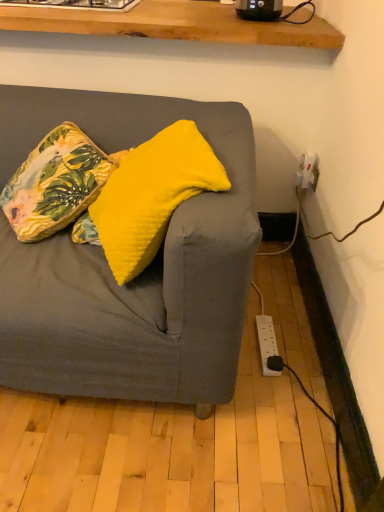
Question: From the image's perspective, is yellow soft cushion at center, arranged as the 1th pillow when viewed from the right, positioned above or below floral fabric cushion at upper left, acting as the first pillow starting from the left?

Choices:
 (A) above
 (B) below

Answer: (B)

Question: Visually, is yellow soft cushion at center, arranged as the 1th pillow when viewed from the right, positioned to the left or to the right of floral fabric cushion at upper left, which is the second pillow in right-to-left order?

Choices:
 (A) right
 (B) left

Answer: (A)

Question: Relative to floral fabric cushion at upper left, which is the second pillow in right-to-left order, is yellow soft cushion at center, arranged as the 1th pillow when viewed from the right, in front or behind?

Choices:
 (A) front
 (B) behind

Answer: (A)

Question: In terms of width, does floral fabric cushion at upper left, which is the second pillow in right-to-left order, look wider or thinner when compared to yellow soft cushion at center, which is the 2th pillow in left-to-right order?

Choices:
 (A) wide
 (B) thin

Answer: (A)

Question: Based on their positions, is floral fabric cushion at upper left, which is the second pillow in right-to-left order, located to the left or right of yellow soft cushion at center, which is the 2th pillow in left-to-right order?

Choices:
 (A) right
 (B) left

Answer: (B)

Question: From the image's perspective, relative to yellow soft cushion at center, which is the 2th pillow in left-to-right order, is floral fabric cushion at upper left, acting as the first pillow starting from the left, above or below?

Choices:
 (A) below
 (B) above

Answer: (B)

Question: In the image, is floral fabric cushion at upper left, acting as the first pillow starting from the left, positioned in front of or behind yellow soft cushion at center, which is the 2th pillow in left-to-right order?

Choices:
 (A) front
 (B) behind

Answer: (B)